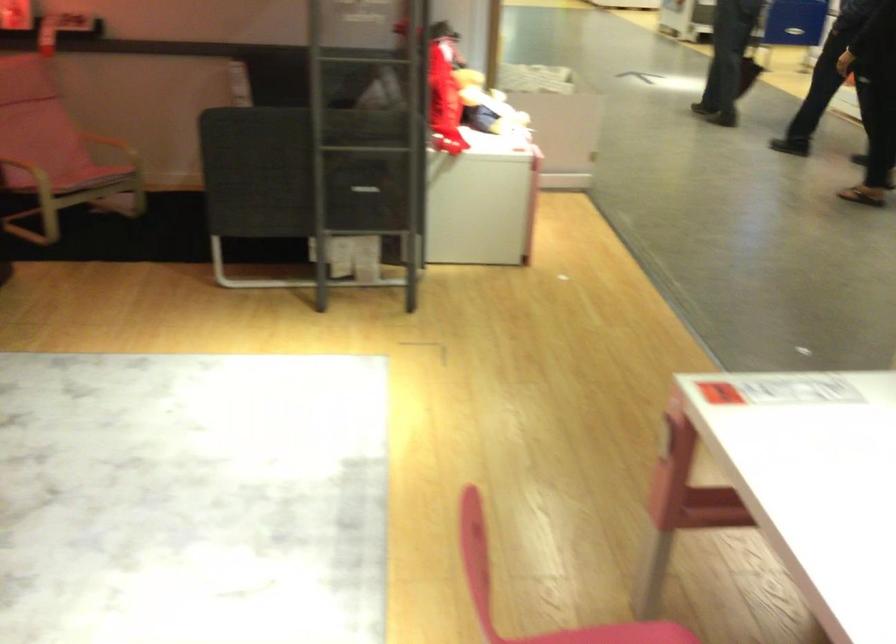
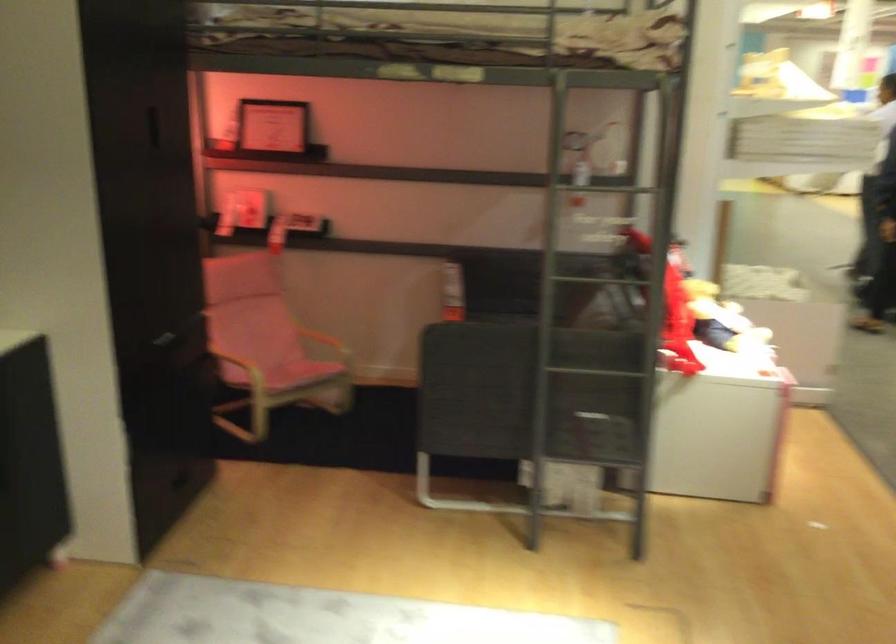
The images are taken continuously from a first-person perspective. In which direction are you moving?

The movement direction of the cameraman is left, forward.